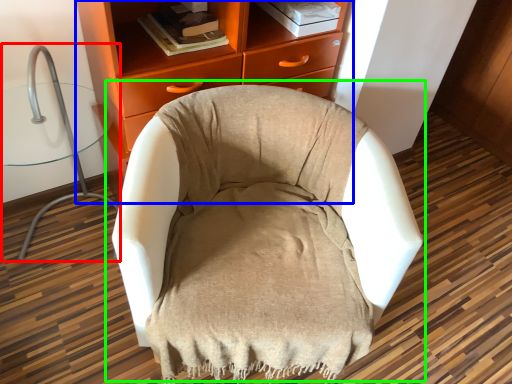
Question: Which is nearer to the computer chair (highlighted by a red box)? chest of drawers (highlighted by a blue box) or chair (highlighted by a green box).

Choices:
 (A) chest of drawers
 (B) chair

Answer: (A)